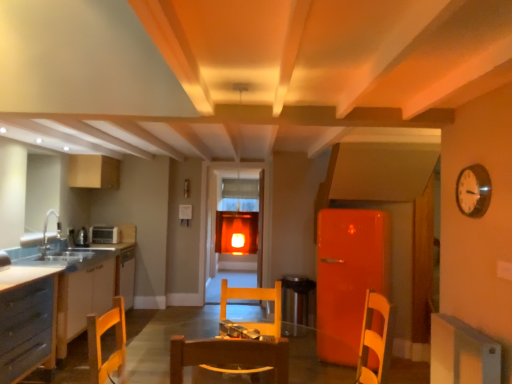
Question: Does white matte cabinet at lower right, which ranks as the second cabinetry in top-to-bottom order, have a smaller size compared to transparent glass door at center?

Choices:
 (A) no
 (B) yes

Answer: (B)

Question: Can you confirm if white matte cabinet at lower right, marked as the first cabinetry in a right-to-left arrangement, is positioned to the right of transparent glass door at center?

Choices:
 (A) no
 (B) yes

Answer: (B)

Question: Can you confirm if white matte cabinet at lower right, arranged as the first cabinetry when viewed from the front, is shorter than transparent glass door at center?

Choices:
 (A) no
 (B) yes

Answer: (B)

Question: Is the position of white matte cabinet at lower right, the 2th cabinetry ordered from the bottom, more distant than that of transparent glass door at center?

Choices:
 (A) yes
 (B) no

Answer: (B)

Question: Is white matte cabinet at lower right, the 2th cabinetry ordered from the bottom, bigger than transparent glass door at center?

Choices:
 (A) yes
 (B) no

Answer: (B)

Question: From a real-world perspective, is white matte cabinet at lower right, the 2th cabinetry ordered from the bottom, below transparent glass door at center?

Choices:
 (A) yes
 (B) no

Answer: (A)

Question: Is white glossy countertop at left facing towards wooden chair at center?

Choices:
 (A) no
 (B) yes

Answer: (A)

Question: Considering the relative sizes of white glossy countertop at left and wooden chair at center in the image provided, is white glossy countertop at left taller than wooden chair at center?

Choices:
 (A) no
 (B) yes

Answer: (B)

Question: Is the depth of white glossy countertop at left greater than that of wooden chair at center?

Choices:
 (A) yes
 (B) no

Answer: (A)

Question: Can you confirm if white glossy countertop at left is positioned to the right of wooden chair at center?

Choices:
 (A) yes
 (B) no

Answer: (B)

Question: Is white glossy countertop at left positioned in front of wooden chair at center?

Choices:
 (A) no
 (B) yes

Answer: (A)

Question: Is white glossy countertop at left not near wooden chair at center?

Choices:
 (A) no
 (B) yes

Answer: (B)

Question: Is wooden round table at center not close to wooden chair at center?

Choices:
 (A) no
 (B) yes

Answer: (B)